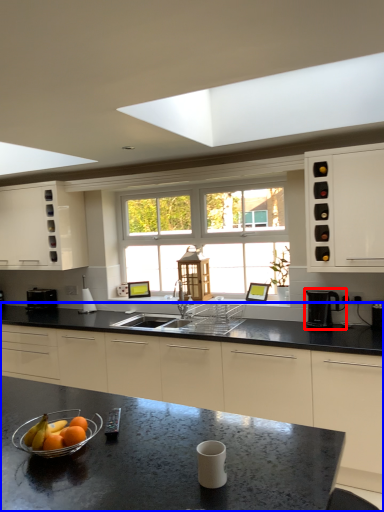
Question: Which of the following is the closest to the observer, coffee machine (highlighted by a red box) or countertop (highlighted by a blue box)?

Choices:
 (A) coffee machine
 (B) countertop

Answer: (B)